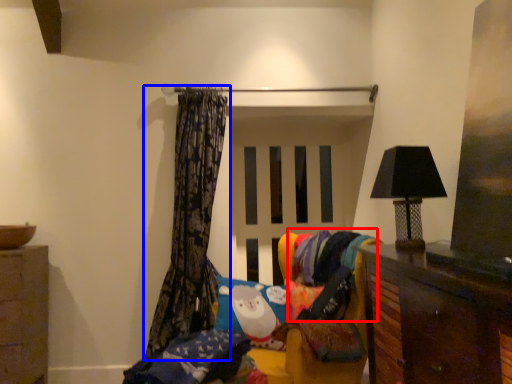
Question: Among these objects, which one is farthest to the camera, fabric (highlighted by a red box) or curtain (highlighted by a blue box)?

Choices:
 (A) fabric
 (B) curtain

Answer: (B)